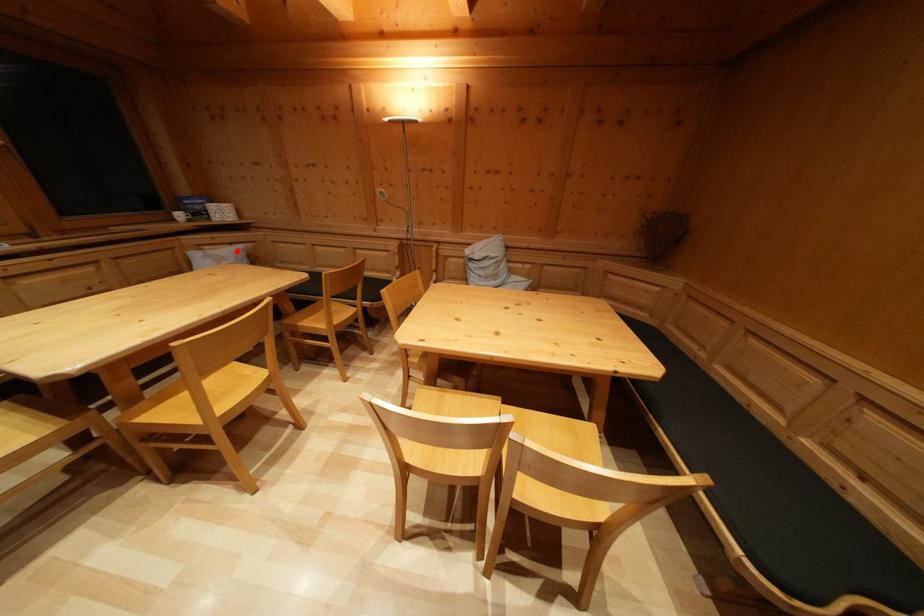
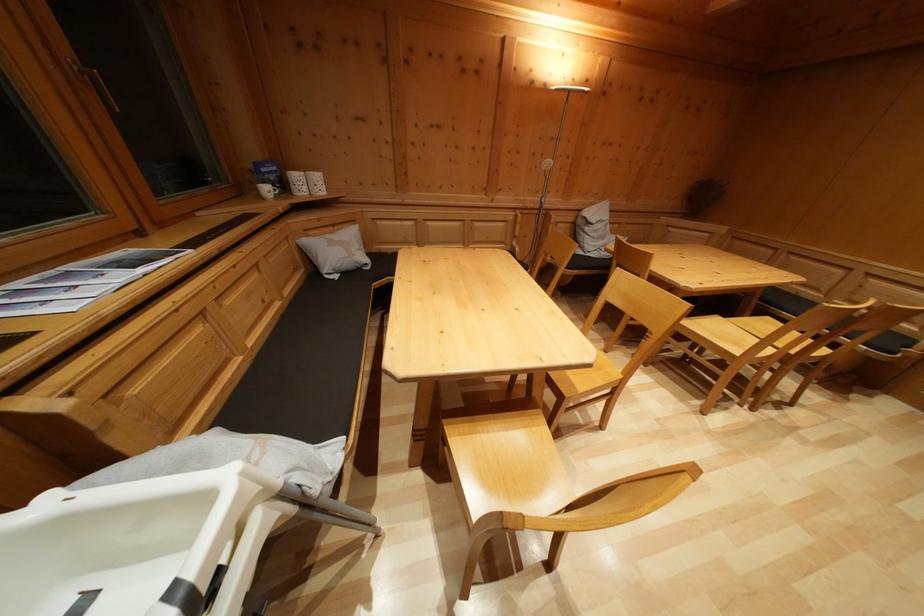
Locate, in the second image, the point that corresponds to the highlighted location in the first image.

(338, 233)